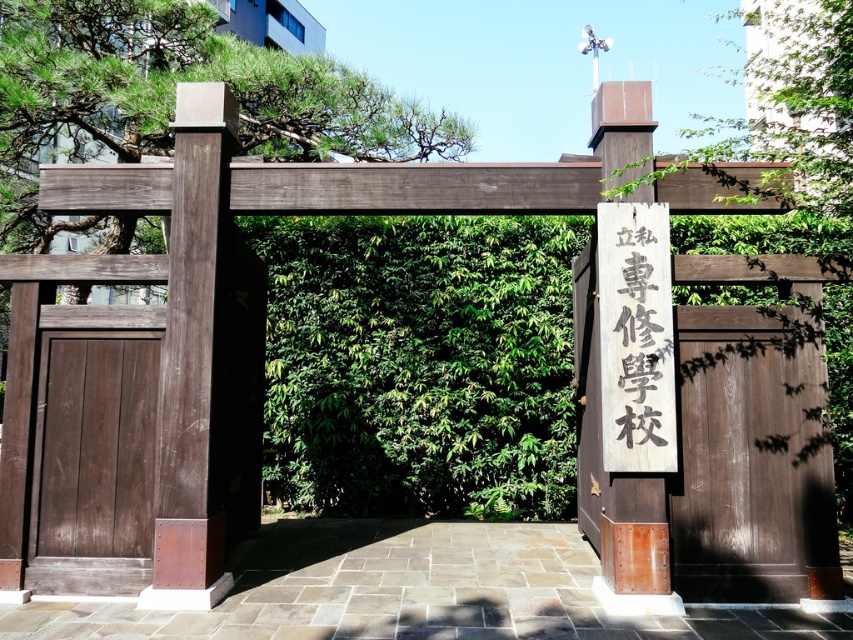
Question: Which object is positioned farthest from the brown wooden door at center?

Choices:
 (A) green leafy tree at center
 (B) dark brown wood door at left

Answer: (B)

Question: From the image, what is the correct spatial relationship of brown wooden door at center in relation to dark brown wood door at left?

Choices:
 (A) above
 (B) below

Answer: (A)

Question: Which object is positioned farthest from the dark brown wood door at left?

Choices:
 (A) brown wooden door at center
 (B) green leafy tree at center

Answer: (B)

Question: Where is dark brown wood door at left located in relation to green leafy tree at center in the image?

Choices:
 (A) right
 (B) left

Answer: (B)

Question: From the image, what is the correct spatial relationship of brown wooden door at center in relation to green leafy tree at center?

Choices:
 (A) above
 (B) below

Answer: (B)

Question: Among these points, which one is farthest from the camera?

Choices:
 (A) (90, 520)
 (B) (848, 310)

Answer: (B)